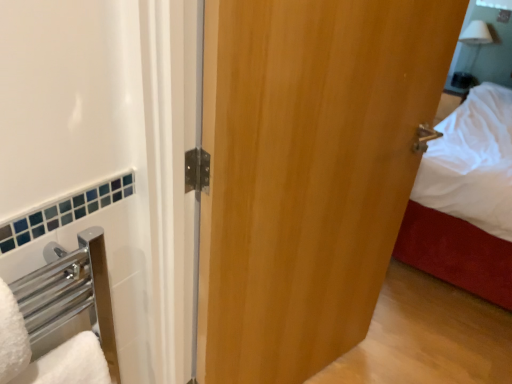
Question: From a real-world perspective, is wooden door at center below white glossy mirror at upper right?

Choices:
 (A) no
 (B) yes

Answer: (B)

Question: Considering the relative sizes of wooden door at center and white glossy mirror at upper right in the image provided, is wooden door at center taller than white glossy mirror at upper right?

Choices:
 (A) yes
 (B) no

Answer: (A)

Question: Is the depth of wooden door at center less than that of white glossy mirror at upper right?

Choices:
 (A) yes
 (B) no

Answer: (A)

Question: From the image's perspective, would you say wooden door at center is positioned over white glossy mirror at upper right?

Choices:
 (A) no
 (B) yes

Answer: (A)

Question: Considering the relative sizes of wooden door at center and white glossy mirror at upper right in the image provided, is wooden door at center bigger than white glossy mirror at upper right?

Choices:
 (A) yes
 (B) no

Answer: (A)

Question: Is wooden door at center inside the boundaries of white glossy mirror at upper right, or outside?

Choices:
 (A) inside
 (B) outside

Answer: (B)

Question: From the image's perspective, is wooden door at center above or below white glossy mirror at upper right?

Choices:
 (A) above
 (B) below

Answer: (B)

Question: Looking at the image, does wooden door at center seem bigger or smaller compared to white glossy mirror at upper right?

Choices:
 (A) big
 (B) small

Answer: (A)

Question: Is wooden door at center to the left or to the right of white glossy mirror at upper right in the image?

Choices:
 (A) right
 (B) left

Answer: (B)

Question: Is white glossy mirror at upper right wider or thinner than wooden door at center?

Choices:
 (A) thin
 (B) wide

Answer: (B)

Question: Is point (493, 41) closer or farther from the camera than point (283, 61)?

Choices:
 (A) farther
 (B) closer

Answer: (A)

Question: In the image, is white glossy mirror at upper right on the left side or the right side of wooden door at center?

Choices:
 (A) right
 (B) left

Answer: (A)

Question: Considering their positions, is white glossy mirror at upper right located in front of or behind wooden door at center?

Choices:
 (A) behind
 (B) front

Answer: (A)

Question: Does point (422, 44) appear closer or farther from the camera than point (4, 289)?

Choices:
 (A) closer
 (B) farther

Answer: (B)

Question: In terms of height, does wooden door at center look taller or shorter compared to white fluffy bath towel at lower left?

Choices:
 (A) short
 (B) tall

Answer: (B)